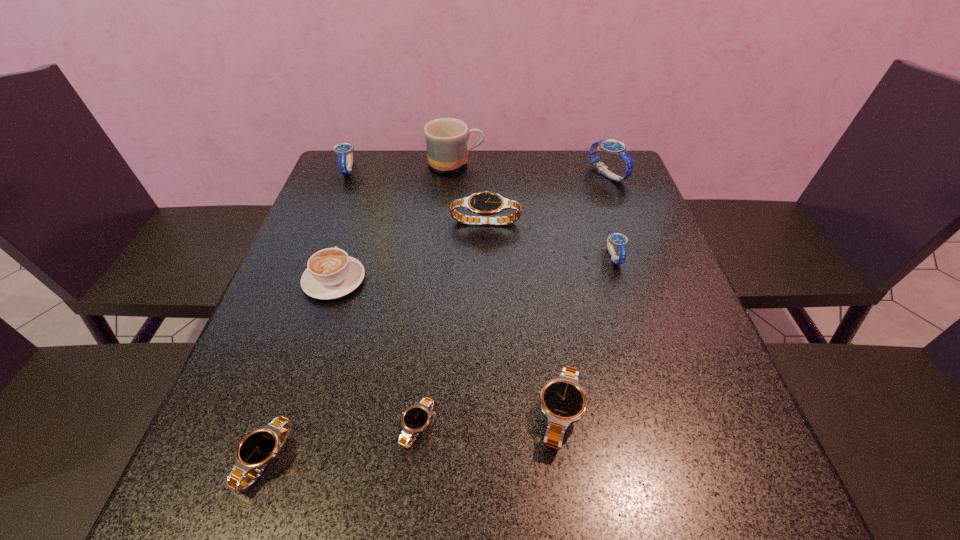
This screenshot has height=540, width=960. What are the coordinates of `object that is at the near left corner` in the screenshot? It's located at (256, 450).

Find the location of a particular element. object at the far right corner is located at coordinates (614, 147).

In the image, there is a desktop. What are the coordinates of `vacant region at the far edge` in the screenshot? It's located at (558, 165).

Find the location of a particular element. Image resolution: width=960 pixels, height=540 pixels. free point at the left edge is located at coordinates (x=344, y=195).

Find the location of a particular element. The width and height of the screenshot is (960, 540). vacant space at the right edge of the desktop is located at coordinates (644, 386).

Locate an element on the screen. Image resolution: width=960 pixels, height=540 pixels. free location at the far left corner is located at coordinates (371, 190).

At what (x,y) coordinates should I click in order to perform the action: click on empty location between the smallest blue watch and the third watch from left to right. Please return your answer as a coordinate pair (x, y). The width and height of the screenshot is (960, 540). Looking at the image, I should click on (516, 342).

In order to click on unoccupied position between the biggest black watch and the third smallest black watch in this screenshot , I will do `click(522, 318)`.

This screenshot has height=540, width=960. In order to click on empty space between the third black watch from right to left and the third farthest watch in this screenshot , I will do `click(451, 324)`.

Where is `free space between the fourth nearest watch and the tallest object`? The image size is (960, 540). free space between the fourth nearest watch and the tallest object is located at coordinates (535, 211).